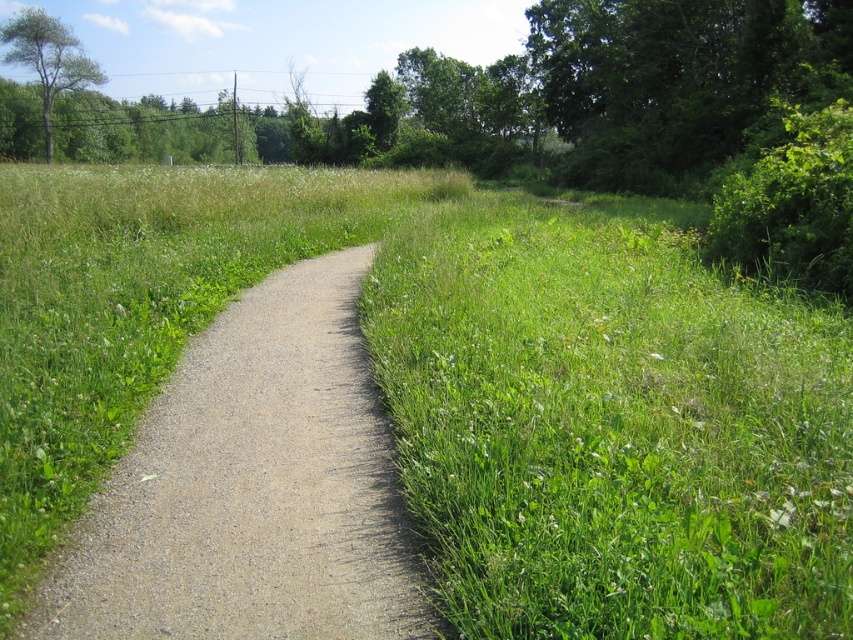
Question: Is gray gravel path at center closer to the viewer compared to green leafy tree at upper left?

Choices:
 (A) no
 (B) yes

Answer: (B)

Question: Where is gray gravel path at center located in relation to green leafy tree at upper left in the image?

Choices:
 (A) above
 (B) below

Answer: (B)

Question: Can you confirm if gray gravel path at center is smaller than green leafy tree at upper left?

Choices:
 (A) no
 (B) yes

Answer: (B)